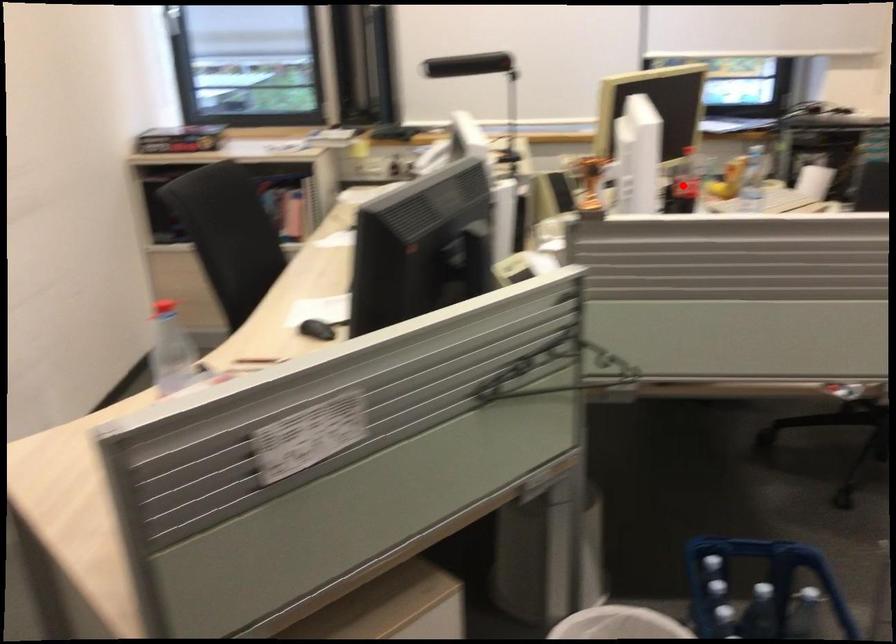
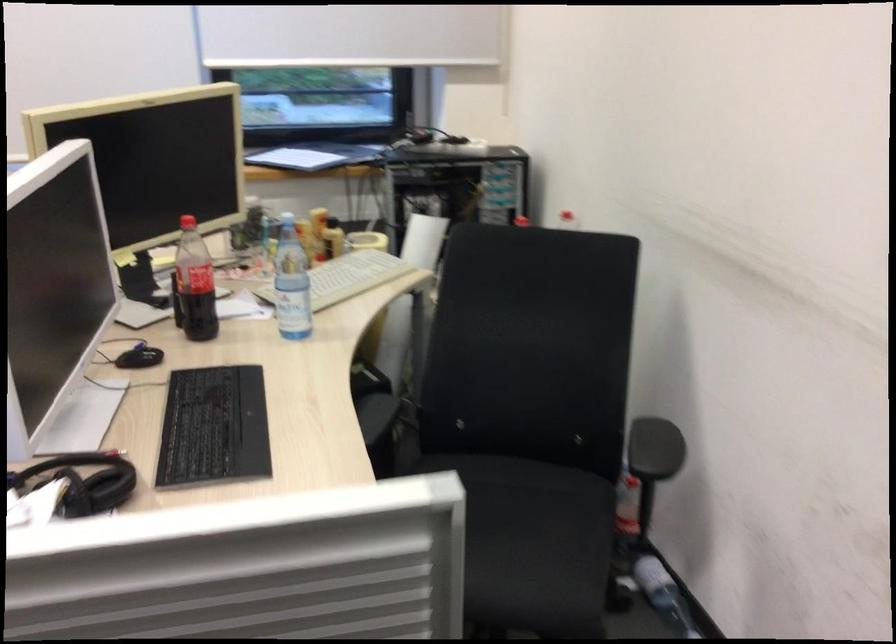
Question: A red point is marked in image1. In image2, is the corresponding 3D point closer to the camera or farther? Reply with the corresponding letter.

Choices:
 (A) The corresponding 3D point is closer.
 (B) The corresponding 3D point is farther.

Answer: (A)